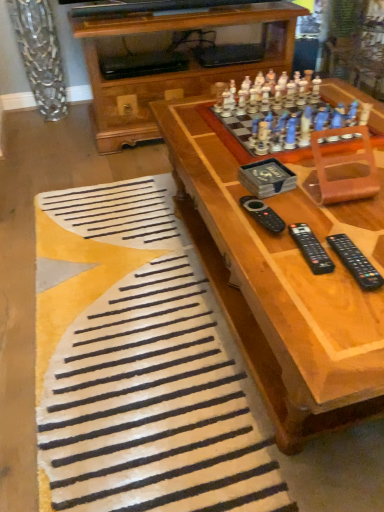
Question: From the image's perspective, is white soft rug at lower center on top of wooden chess set at upper right?

Choices:
 (A) yes
 (B) no

Answer: (B)

Question: From a real-world perspective, is white soft rug at lower center physically below wooden chess set at upper right?

Choices:
 (A) no
 (B) yes

Answer: (B)

Question: Is white soft rug at lower center outside wooden chess set at upper right?

Choices:
 (A) yes
 (B) no

Answer: (A)

Question: From a real-world perspective, is white soft rug at lower center positioned over wooden chess set at upper right based on gravity?

Choices:
 (A) no
 (B) yes

Answer: (A)

Question: Is white soft rug at lower center to the left of wooden chess set at upper right from the viewer's perspective?

Choices:
 (A) no
 (B) yes

Answer: (B)

Question: Is black plastic remote at lower right, acting as the 2th remote starting from the right, spatially inside wooden chess set at upper right, or outside of it?

Choices:
 (A) outside
 (B) inside

Answer: (A)

Question: From a real-world perspective, is black plastic remote at lower right, which ranks as the second remote in left-to-right order, physically located above or below wooden chess set at upper right?

Choices:
 (A) below
 (B) above

Answer: (A)

Question: Considering the positions of black plastic remote at lower right, which ranks as the second remote in left-to-right order, and wooden chess set at upper right in the image, is black plastic remote at lower right, which ranks as the second remote in left-to-right order, wider or thinner than wooden chess set at upper right?

Choices:
 (A) wide
 (B) thin

Answer: (B)

Question: Is black plastic remote at lower right, acting as the 2th remote starting from the right, bigger or smaller than wooden chess set at upper right?

Choices:
 (A) small
 (B) big

Answer: (A)

Question: Looking at their shapes, would you say wooden chess set at center is wider or thinner than white soft rug at lower center?

Choices:
 (A) wide
 (B) thin

Answer: (B)

Question: Does point (360, 367) appear closer or farther from the camera than point (147, 309)?

Choices:
 (A) farther
 (B) closer

Answer: (B)

Question: From a real-world perspective, relative to white soft rug at lower center, is wooden chess set at center vertically above or below?

Choices:
 (A) above
 (B) below

Answer: (A)

Question: Is wooden chess set at center inside the boundaries of white soft rug at lower center, or outside?

Choices:
 (A) inside
 (B) outside

Answer: (B)

Question: Which is correct: wooden chess set at center is inside black plastic remote at center, which is counted as the 1th remote, starting from the left, or outside of it?

Choices:
 (A) outside
 (B) inside

Answer: (A)

Question: Is point (334, 394) positioned closer to the camera than point (269, 217)?

Choices:
 (A) closer
 (B) farther

Answer: (A)